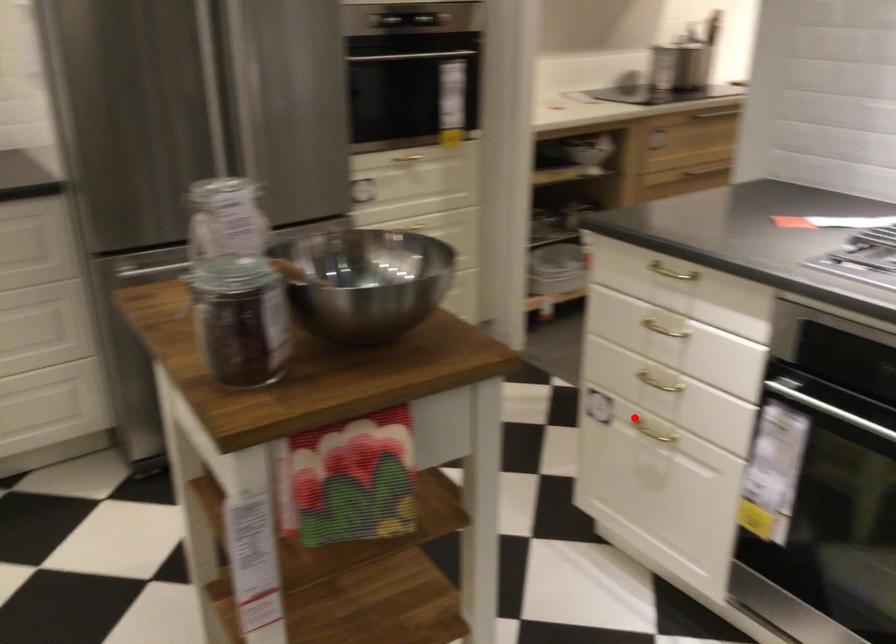
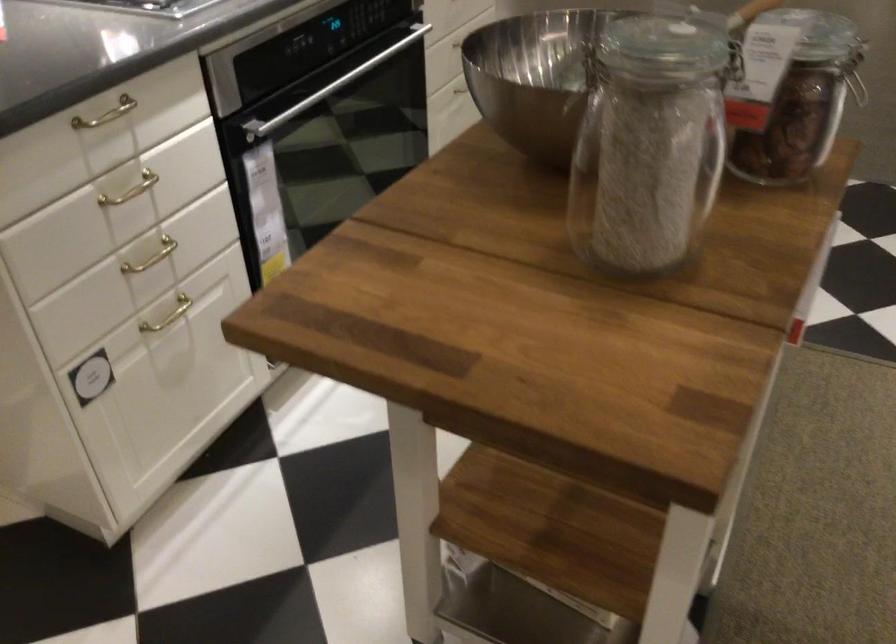
Question: I am providing you with two images of the same scene from different viewpoints. A red point is shown in image1. For the corresponding object point in image2, is it positioned nearer or farther from the camera?

Choices:
 (A) Nearer
 (B) Farther

Answer: (A)